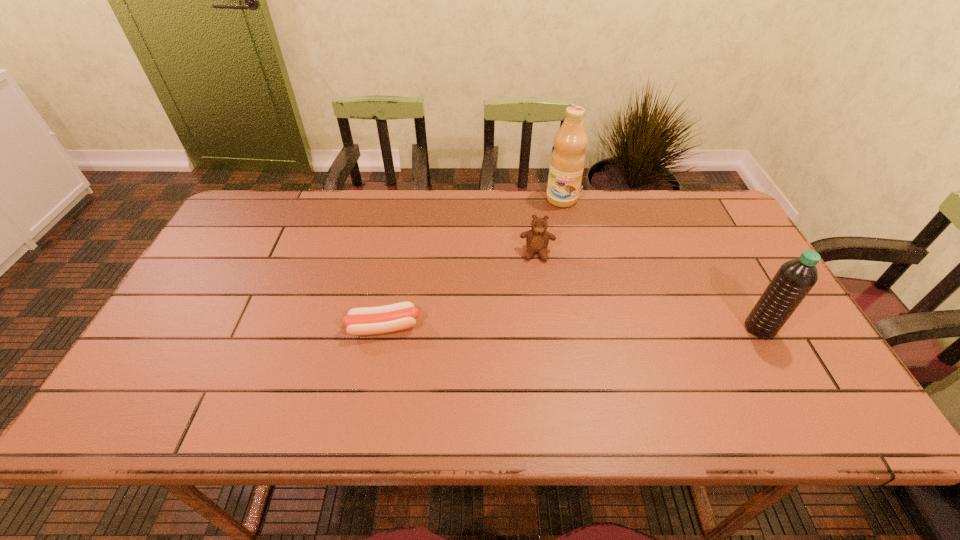
Identify the location of free space located at the face of the third tallest object. (532, 371).

Where is `vacant space situated 0.210m at the face of the third tallest object`? This screenshot has width=960, height=540. vacant space situated 0.210m at the face of the third tallest object is located at coordinates click(x=534, y=320).

Where is `free space located 0.170m at the face of the third tallest object`? The image size is (960, 540). free space located 0.170m at the face of the third tallest object is located at coordinates [x=535, y=308].

Identify the location of free space located on the label of the farthest object. (550, 246).

Find the location of `vacant space situated on the label of the farthest object`. vacant space situated on the label of the farthest object is located at coordinates (554, 231).

Find the location of `vacant space located on the label of the farthest object`. vacant space located on the label of the farthest object is located at coordinates (547, 257).

You are a GUI agent. You are given a task and a screenshot of the screen. Output one action in this format:
    pyautogui.click(x=<x>, y=<y>)
    Task: Click on the object that is at the far edge
    This screenshot has width=960, height=540.
    Given the screenshot: What is the action you would take?
    [x=567, y=161]

This screenshot has height=540, width=960. I want to click on object situated at the right edge, so click(x=794, y=279).

In the image, there is a desktop. Where is `vacant space at the far edge`? The width and height of the screenshot is (960, 540). vacant space at the far edge is located at coordinates (612, 202).

In order to click on vacant space at the near edge of the desktop in this screenshot , I will do `click(671, 361)`.